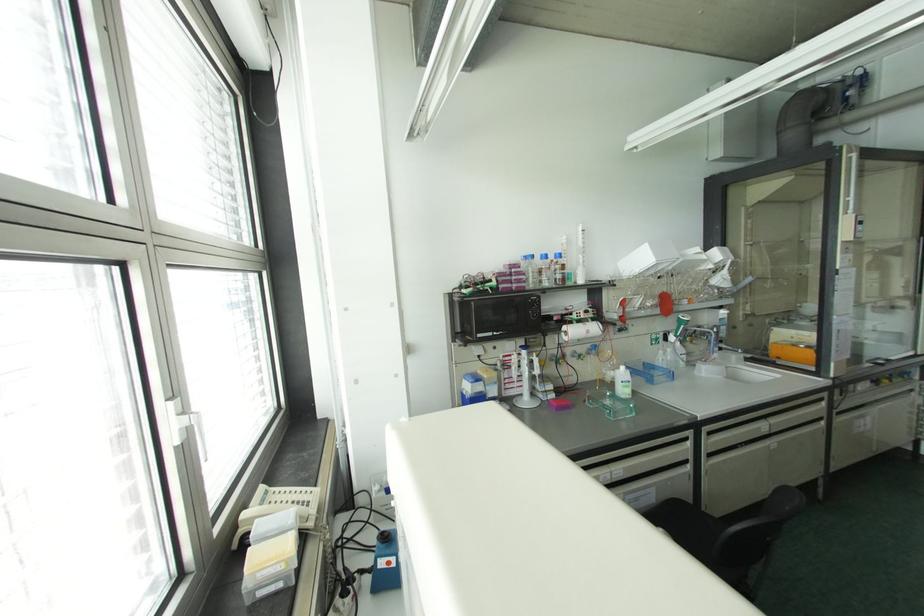
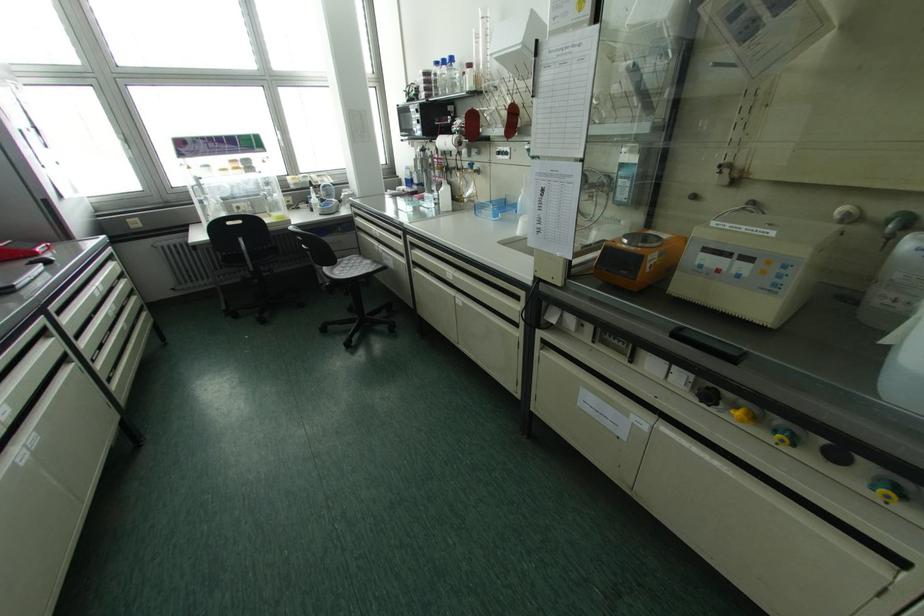
Find the pixel in the second image that matches [531,256] in the first image.

(435, 63)